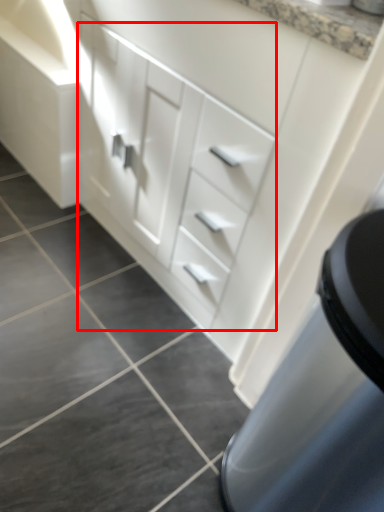
Question: From the image, what is the correct spatial relationship of drawer (annotated by the red box) in relation to tile?

Choices:
 (A) right
 (B) left

Answer: (A)